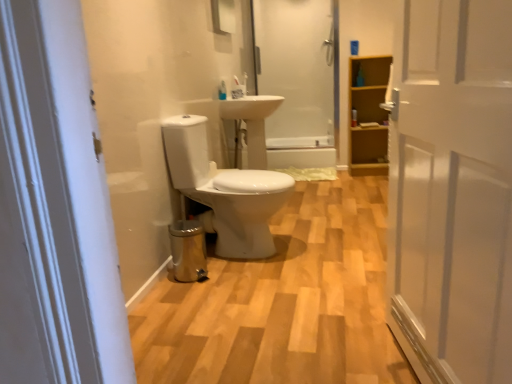
The image size is (512, 384). Identify the location of vacant space in front of light brown wood cabinet at right. click(x=367, y=177).